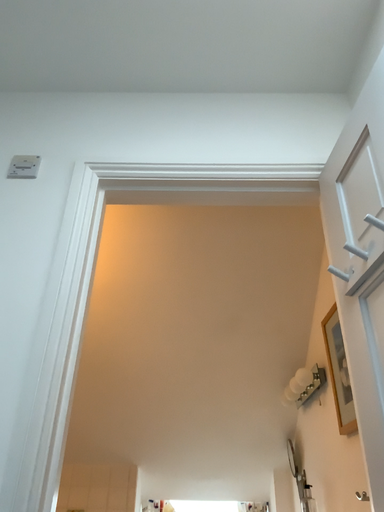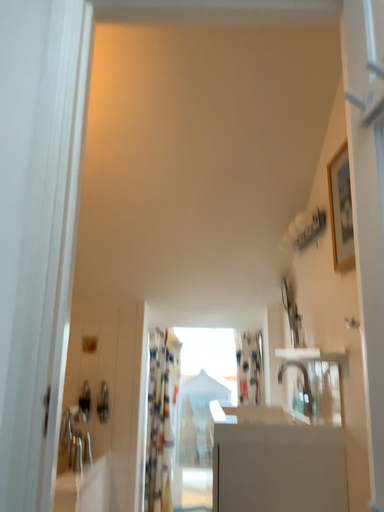
Question: Which way did the camera rotate in the video?

Choices:
 (A) rotated upward
 (B) rotated downward

Answer: (B)